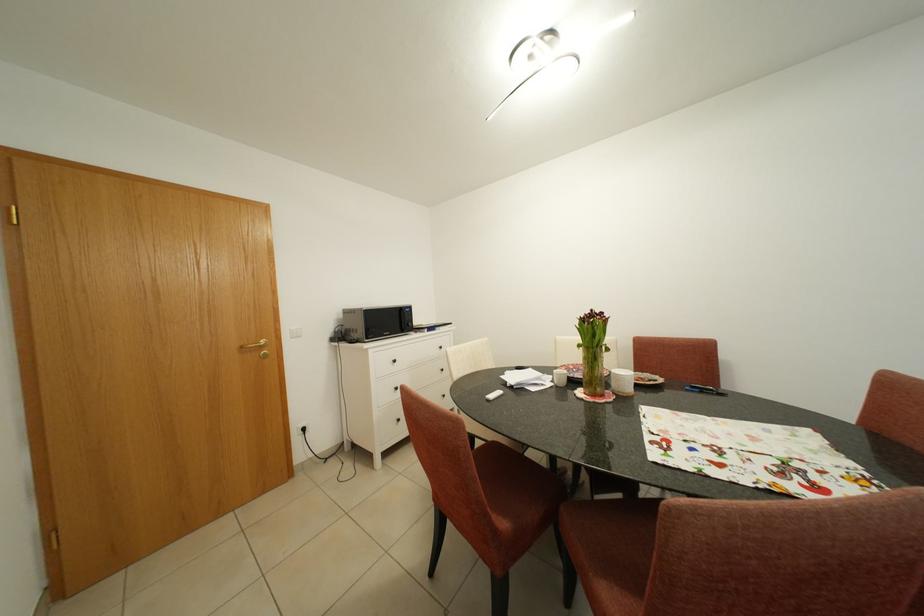
Identify the location of red chair sitting surface. The image size is (924, 616). (618, 556).